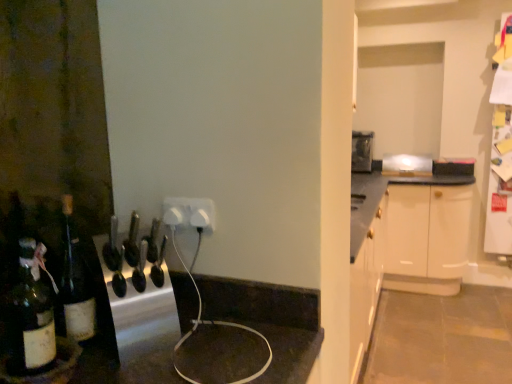
Image resolution: width=512 pixels, height=384 pixels. What are the coordinates of `translucent glass bottle at left` in the screenshot? It's located at (76, 283).

Measure the distance between translucent glass bottle at left and camera.

translucent glass bottle at left is 33.94 inches away from camera.

What is the approximate height of white plastic outlet at center?

The height of white plastic outlet at center is 3.49 inches.

The height and width of the screenshot is (384, 512). Find the location of `white plastic outlet at center`. white plastic outlet at center is located at coordinates (189, 212).

This screenshot has width=512, height=384. I want to click on metallic silver toaster at upper center, placed as the first appliance when sorted from right to left, so click(362, 151).

From the image's perspective, is translucent glass bottle at left over metallic silver toaster at upper center, which is the first appliance from top to bottom?

No, from the image's perspective, translucent glass bottle at left is not over metallic silver toaster at upper center, which is the first appliance from top to bottom.

From the picture: In terms of width, does translucent glass bottle at left look wider or thinner when compared to metallic silver toaster at upper center, which is the 2th appliance in front-to-back order?

Clearly, translucent glass bottle at left has less width compared to metallic silver toaster at upper center, which is the 2th appliance in front-to-back order.

Looking at this image, is translucent glass bottle at left aimed at metallic silver toaster at upper center, which is the 2th appliance in front-to-back order?

No, translucent glass bottle at left is not oriented towards metallic silver toaster at upper center, which is the 2th appliance in front-to-back order.

From a real-world perspective, is translucent glass bottle at left physically located above or below metallic silver toaster at upper center, which is the first appliance from top to bottom?

In terms of real-world spatial position, translucent glass bottle at left is below metallic silver toaster at upper center, which is the first appliance from top to bottom.

Considering the sizes of white plastic outlet at center and metallic silver knife block at center, the 2th appliance in the top-to-bottom sequence, in the image, is white plastic outlet at center taller or shorter than metallic silver knife block at center, the 2th appliance in the top-to-bottom sequence,?

Considering their sizes, white plastic outlet at center has less height than metallic silver knife block at center, the 2th appliance in the top-to-bottom sequence.

How many degrees apart are the facing directions of white plastic outlet at center and metallic silver knife block at center, which ranks as the first appliance in bottom-to-top order?

They differ by 59.7 degrees in their facing directions.

Between white plastic outlet at center and metallic silver knife block at center, which is counted as the first appliance, starting from the front, which one has smaller size?

Smaller between the two is white plastic outlet at center.

Which object is wider, white plastic outlet at center or metallic silver knife block at center, the 2th appliance in the top-to-bottom sequence?

metallic silver knife block at center, the 2th appliance in the top-to-bottom sequence.

Which of these two, translucent glass bottle at left or metallic silver knife block at center, which is counted as the first appliance, starting from the front, stands taller?

With more height is translucent glass bottle at left.

Can you tell me how much translucent glass bottle at left and metallic silver knife block at center, which ranks as the first appliance in bottom-to-top order, differ in facing direction?

The angle between the facing direction of translucent glass bottle at left and the facing direction of metallic silver knife block at center, which ranks as the first appliance in bottom-to-top order, is 35.5 degrees.

Which object is wider, translucent glass bottle at left or metallic silver knife block at center, which is the second appliance from back to front?

metallic silver knife block at center, which is the second appliance from back to front.

Would you say translucent glass bottle at left is a long distance from metallic silver knife block at center, which is counted as the first appliance, starting from the front?

No, translucent glass bottle at left is in close proximity to metallic silver knife block at center, which is counted as the first appliance, starting from the front.

How different are the orientations of white plastic outlet at center and dark brown glass bottle at lower left in degrees?

They differ by 95 degrees in their facing directions.

Which is in front, white plastic outlet at center or dark brown glass bottle at lower left?

dark brown glass bottle at lower left is closer to the camera.

Between white plastic outlet at center and dark brown glass bottle at lower left, which one has more height?

With more height is dark brown glass bottle at lower left.

Is white plastic outlet at center bigger than dark brown glass bottle at lower left?

Actually, white plastic outlet at center might be smaller than dark brown glass bottle at lower left.

Considering the sizes of metallic silver toaster at upper center, which is the 2th appliance from left to right, and metallic silver knife block at center, the 2th appliance in the top-to-bottom sequence, in the image, is metallic silver toaster at upper center, which is the 2th appliance from left to right, taller or shorter than metallic silver knife block at center, the 2th appliance in the top-to-bottom sequence,?

Considering their sizes, metallic silver toaster at upper center, which is the 2th appliance from left to right, has more height than metallic silver knife block at center, the 2th appliance in the top-to-bottom sequence.

Is metallic silver toaster at upper center, which is the 2th appliance from left to right, wider or thinner than metallic silver knife block at center, the 2th appliance in the top-to-bottom sequence?

metallic silver toaster at upper center, which is the 2th appliance from left to right, is wider than metallic silver knife block at center, the 2th appliance in the top-to-bottom sequence.

Is point (367, 148) more distant than point (117, 348)?

Yes, it is.

Would you say metallic silver knife block at center, which is the second appliance from back to front, is to the left or to the right of white plastic outlet at center in the picture?

metallic silver knife block at center, which is the second appliance from back to front, is to the left of white plastic outlet at center.

Is metallic silver knife block at center, which ranks as the first appliance in bottom-to-top order, touching white plastic outlet at center?

No.

Based on the photo, can you confirm if metallic silver knife block at center, which ranks as the first appliance in bottom-to-top order, is thinner than white plastic outlet at center?

No.

From the image's perspective, is metallic silver knife block at center, which is counted as the first appliance, starting from the front, positioned above or below white plastic outlet at center?

From the image's perspective, metallic silver knife block at center, which is counted as the first appliance, starting from the front, appears below white plastic outlet at center.

From the image's perspective, is metallic silver knife block at center, which ranks as the first appliance in bottom-to-top order, located above or below dark brown glass bottle at lower left?

metallic silver knife block at center, which ranks as the first appliance in bottom-to-top order, is situated higher than dark brown glass bottle at lower left in the image.

Considering the positions of objects metallic silver knife block at center, the first appliance in the left-to-right sequence, and dark brown glass bottle at lower left in the image provided, who is behind, metallic silver knife block at center, the first appliance in the left-to-right sequence, or dark brown glass bottle at lower left?

metallic silver knife block at center, the first appliance in the left-to-right sequence, is further away from the camera.

In order to click on appliance that appears below the dark brown glass bottle at lower left (from a real-world perspective) in this screenshot , I will do `click(139, 311)`.

Considering the sizes of metallic silver knife block at center, acting as the second appliance starting from the right, and dark brown glass bottle at lower left in the image, is metallic silver knife block at center, acting as the second appliance starting from the right, wider or thinner than dark brown glass bottle at lower left?

Considering their sizes, metallic silver knife block at center, acting as the second appliance starting from the right, looks broader than dark brown glass bottle at lower left.

Where is `bottle that appears on the left of metallic silver toaster at upper center, which is the 2th appliance from left to right`? This screenshot has width=512, height=384. bottle that appears on the left of metallic silver toaster at upper center, which is the 2th appliance from left to right is located at coordinates [76, 283].

Locate an element on the screen. appliance below the white plastic outlet at center (from the image's perspective) is located at coordinates (139, 311).

Based on their spatial positions, is white plastic outlet at center or dark brown glass bottle at lower left further from metallic silver knife block at center, which is counted as the first appliance, starting from the front?

The object further to metallic silver knife block at center, which is counted as the first appliance, starting from the front, is white plastic outlet at center.

Estimate the real-world distances between objects in this image. Which object is closer to metallic silver knife block at center, the first appliance in the left-to-right sequence, white plastic outlet at center or translucent glass bottle at left?

translucent glass bottle at left lies closer to metallic silver knife block at center, the first appliance in the left-to-right sequence, than the other object.

From the image, which object appears to be farther from metallic silver knife block at center, which is the second appliance from back to front, translucent glass bottle at left or white plastic outlet at center?

Based on the image, white plastic outlet at center appears to be further to metallic silver knife block at center, which is the second appliance from back to front.

From the image, which object appears to be farther from white plastic outlet at center, metallic silver toaster at upper center, placed as the first appliance when sorted from right to left, or metallic silver knife block at center, acting as the second appliance starting from the right?

metallic silver toaster at upper center, placed as the first appliance when sorted from right to left.

In the scene shown: Considering their positions, is translucent glass bottle at left positioned further to metallic silver toaster at upper center, which is the 2th appliance in front-to-back order, than dark brown glass bottle at lower left?

dark brown glass bottle at lower left is further to metallic silver toaster at upper center, which is the 2th appliance in front-to-back order.

Which object lies further to the anchor point white plastic outlet at center, dark brown glass bottle at lower left or metallic silver knife block at center, which is the second appliance from back to front?

dark brown glass bottle at lower left is positioned further to the anchor white plastic outlet at center.

Considering their positions, is metallic silver toaster at upper center, placed as the first appliance when sorted from right to left, positioned further to dark brown glass bottle at lower left than translucent glass bottle at left?

The object further to dark brown glass bottle at lower left is metallic silver toaster at upper center, placed as the first appliance when sorted from right to left.

Estimate the real-world distances between objects in this image. Which object is further from metallic silver knife block at center, the first appliance in the left-to-right sequence, dark brown glass bottle at lower left or white plastic outlet at center?

Among the two, white plastic outlet at center is located further to metallic silver knife block at center, the first appliance in the left-to-right sequence.

Where is `bottle between dark brown glass bottle at lower left and white plastic outlet at center from front to back`? bottle between dark brown glass bottle at lower left and white plastic outlet at center from front to back is located at coordinates (76, 283).

This screenshot has height=384, width=512. I want to click on appliance located between dark brown glass bottle at lower left and white plastic outlet at center in the depth direction, so tap(139, 311).

At what (x,y) coordinates should I click in order to perform the action: click on bottle between metallic silver knife block at center, which is the second appliance from back to front, and metallic silver toaster at upper center, which is the first appliance from top to bottom, in the front-back direction. Please return your answer as a coordinate pair (x, y). This screenshot has height=384, width=512. Looking at the image, I should click on pyautogui.click(x=76, y=283).

This screenshot has width=512, height=384. In order to click on electric outlet positioned between metallic silver knife block at center, the first appliance in the left-to-right sequence, and metallic silver toaster at upper center, which is the 2th appliance from left to right, from near to far in this screenshot , I will do `click(189, 212)`.